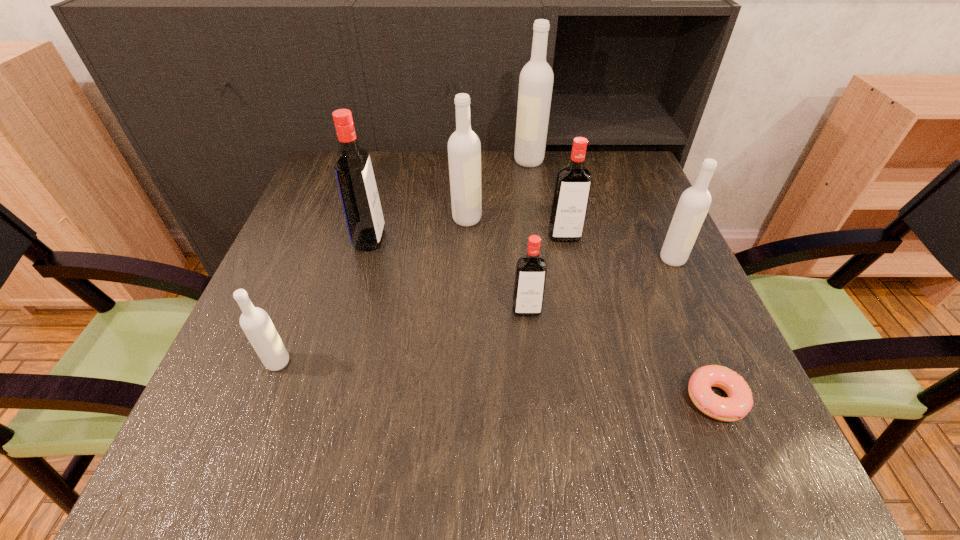
You are a GUI agent. You are given a task and a screenshot of the screen. Output one action in this format:
    pyautogui.click(x=<x>, y=<y>)
    Task: Click on the vacant space situated 0.310m on the front and back of the second nearest vodka
    
    Given the screenshot: What is the action you would take?
    pyautogui.click(x=544, y=487)

Locate an element on the screen. free location located 0.190m on the right of the nearest white vodka is located at coordinates (398, 362).

At what (x,y) coordinates should I click in order to perform the action: click on vacant space located on the left of the pink doughnut. Please return your answer as a coordinate pair (x, y). This screenshot has width=960, height=540. Looking at the image, I should click on (448, 398).

Identify the location of object present at the far edge. Image resolution: width=960 pixels, height=540 pixels. (536, 79).

The height and width of the screenshot is (540, 960). In order to click on vodka situated at the right edge in this screenshot , I will do `click(694, 203)`.

Locate an element on the screen. This screenshot has height=540, width=960. doughnut positioned at the right edge is located at coordinates (740, 400).

Image resolution: width=960 pixels, height=540 pixels. Identify the location of free space at the far edge of the desktop. (550, 187).

At what (x,y) coordinates should I click in order to perform the action: click on vacant space at the left edge of the desktop. Please return your answer as a coordinate pair (x, y). The height and width of the screenshot is (540, 960). Looking at the image, I should click on (315, 226).

At what (x,y) coordinates should I click in order to perform the action: click on vacant space at the right edge. Please return your answer as a coordinate pair (x, y). Looking at the image, I should click on (674, 324).

At what (x,y) coordinates should I click in order to perform the action: click on vacant area between the smallest white vodka and the shortest object. Please return your answer as a coordinate pair (x, y). The image size is (960, 540). Looking at the image, I should click on (496, 380).